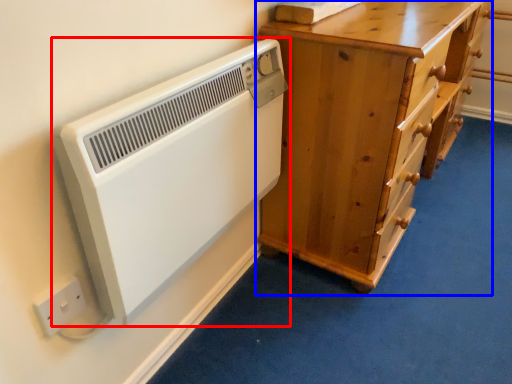
Question: Among these objects, which one is farthest to the camera, home appliance (highlighted by a red box) or chest of drawers (highlighted by a blue box)?

Choices:
 (A) home appliance
 (B) chest of drawers

Answer: (B)